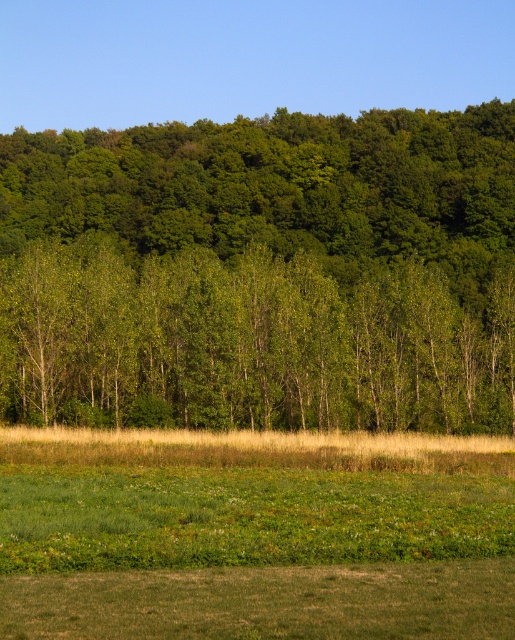
Question: From the image, what is the correct spatial relationship of green leafy trees at upper center in relation to green grassy field at lower center?

Choices:
 (A) above
 (B) below

Answer: (A)

Question: Which object appears closest to the camera in this image?

Choices:
 (A) green grassy field at lower center
 (B) green leafy trees at upper center

Answer: (A)

Question: Does green leafy trees at upper center appear under green grassy field at lower center?

Choices:
 (A) yes
 (B) no

Answer: (B)

Question: Is green leafy trees at upper center to the left of green grassy field at lower center from the viewer's perspective?

Choices:
 (A) yes
 (B) no

Answer: (A)

Question: Which point is closer to the camera taking this photo?

Choices:
 (A) (327, 577)
 (B) (482, 140)

Answer: (A)